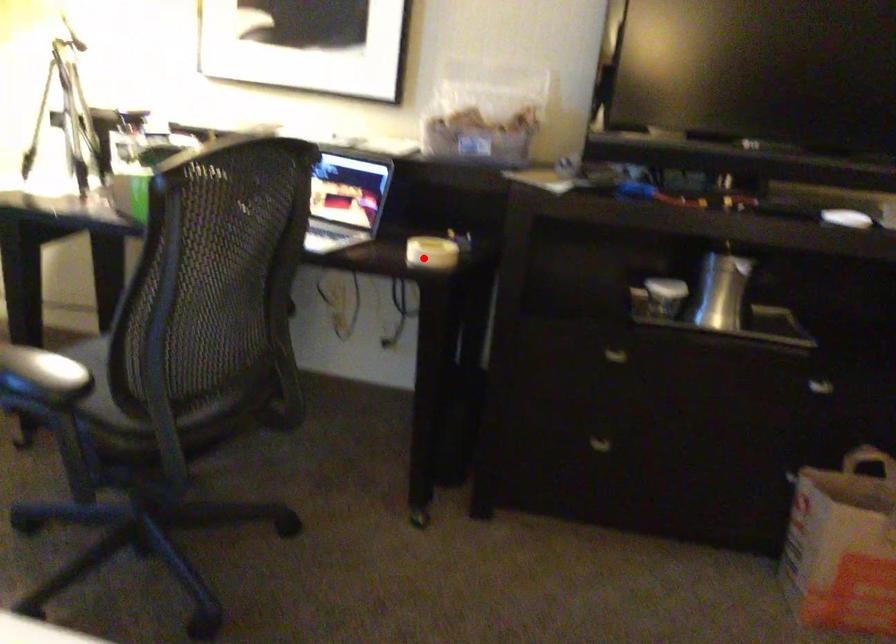
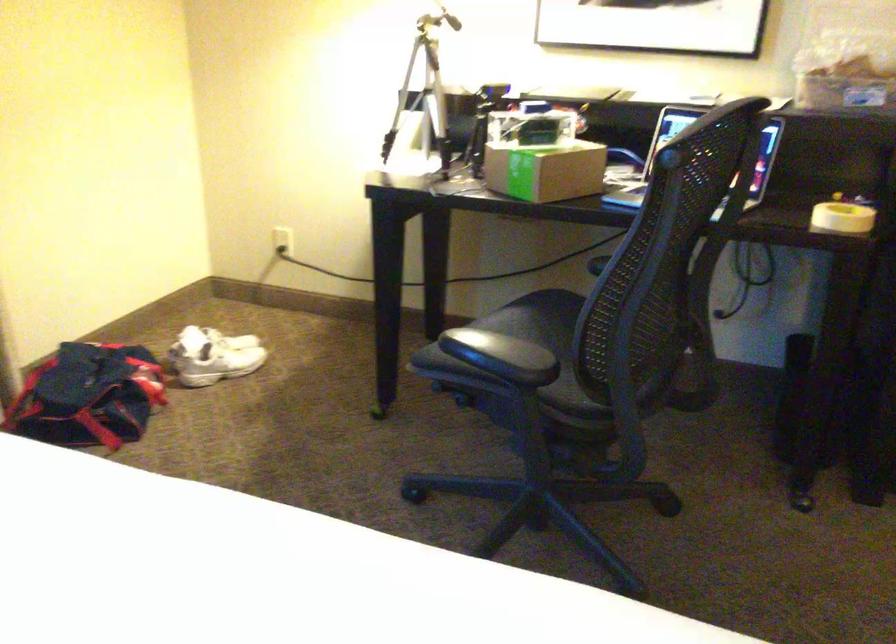
Where in the second image is the point corresponding to the highlighted location from the first image?

(841, 216)